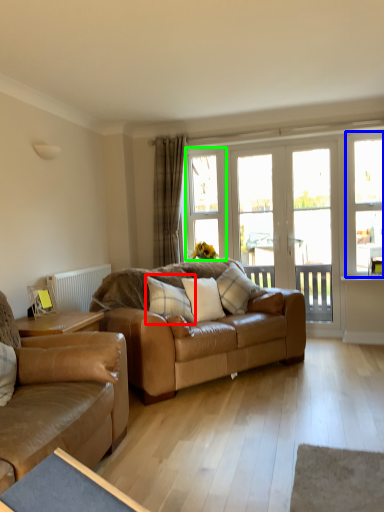
Question: Which is nearer to the pillow (highlighted by a red box)? window (highlighted by a blue box) or window (highlighted by a green box).

Choices:
 (A) window
 (B) window

Answer: (B)